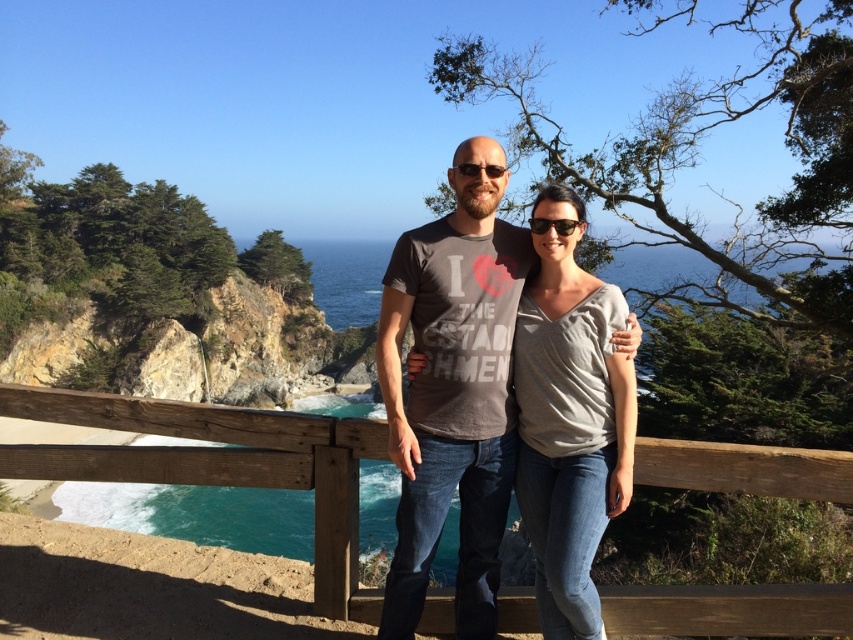
Question: Is wooden at center wider than dark gray t-shirt at center?

Choices:
 (A) yes
 (B) no

Answer: (A)

Question: Which point appears closest to the camera in this image?

Choices:
 (A) (547, 337)
 (B) (15, 464)
 (C) (496, 308)

Answer: (B)

Question: Is the position of wooden at center less distant than that of dark gray t-shirt at center?

Choices:
 (A) yes
 (B) no

Answer: (A)

Question: Among these objects, which one is nearest to the camera?

Choices:
 (A) dark gray t-shirt at center
 (B) gray cotton shirt at center
 (C) wooden at center

Answer: (C)

Question: Estimate the real-world distances between objects in this image. Which object is closer to the dark gray t-shirt at center?

Choices:
 (A) wooden at center
 (B) gray cotton shirt at center

Answer: (A)

Question: Is wooden at center thinner than dark gray t-shirt at center?

Choices:
 (A) yes
 (B) no

Answer: (B)